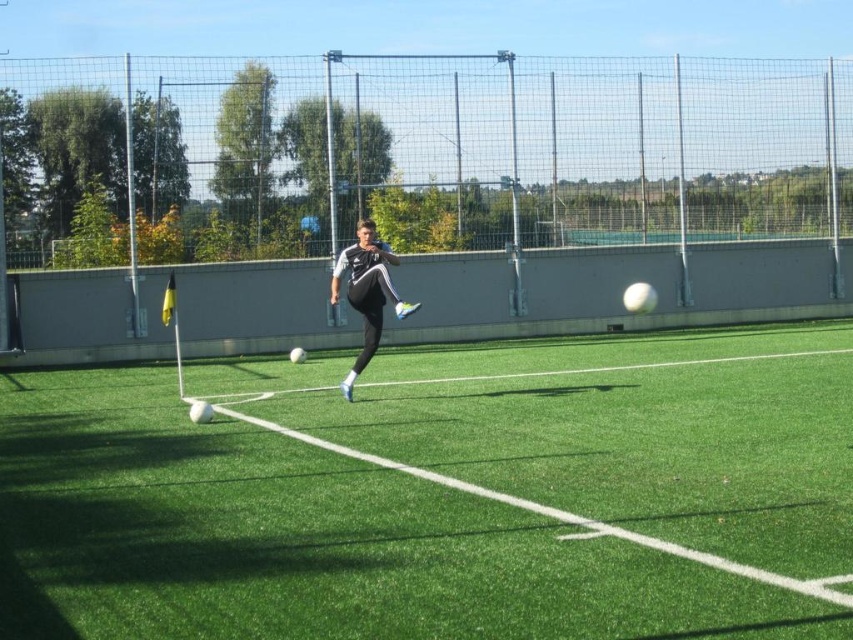
Question: Among these points, which one is nearest to the camera?

Choices:
 (A) (267, 449)
 (B) (386, 285)

Answer: (A)

Question: Does green artificial turf at center have a larger size compared to black matte soccer player at center?

Choices:
 (A) no
 (B) yes

Answer: (B)

Question: Is green artificial turf at center closer to camera compared to black matte soccer player at center?

Choices:
 (A) no
 (B) yes

Answer: (B)

Question: Does green artificial turf at center appear over black matte soccer player at center?

Choices:
 (A) yes
 (B) no

Answer: (B)

Question: Which object is farther from the camera taking this photo?

Choices:
 (A) green artificial turf at center
 (B) black matte soccer player at center

Answer: (B)